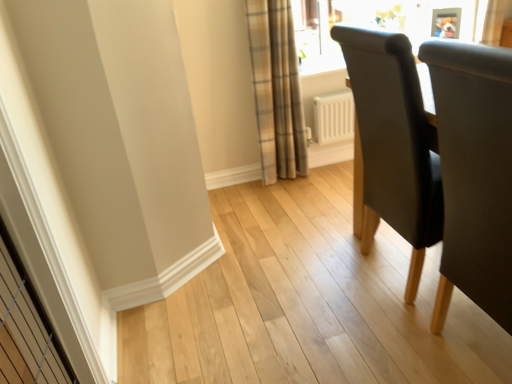
Question: Is black leather chair at right, placed as the 1th chair when sorted from front to back, closer to the viewer compared to plaid fabric curtain at upper center?

Choices:
 (A) yes
 (B) no

Answer: (A)

Question: From a real-world perspective, does black leather chair at right, positioned as the second chair in back-to-front order, stand above plaid fabric curtain at upper center?

Choices:
 (A) yes
 (B) no

Answer: (B)

Question: Are black leather chair at right, positioned as the second chair in back-to-front order, and plaid fabric curtain at upper center beside each other?

Choices:
 (A) no
 (B) yes

Answer: (A)

Question: Is black leather chair at right, placed as the 1th chair when sorted from front to back, thinner than plaid fabric curtain at upper center?

Choices:
 (A) no
 (B) yes

Answer: (A)

Question: Considering the relative positions of black leather chair at right, positioned as the second chair in back-to-front order, and plaid fabric curtain at upper center in the image provided, is black leather chair at right, positioned as the second chair in back-to-front order, to the right of plaid fabric curtain at upper center from the viewer's perspective?

Choices:
 (A) no
 (B) yes

Answer: (B)

Question: Considering their positions, is plaid fabric curtain at upper center located in front of or behind dark gray fabric chair at right, the 2th chair viewed from the front?

Choices:
 (A) front
 (B) behind

Answer: (B)

Question: From a real-world perspective, relative to dark gray fabric chair at right, which is the 1th chair from back to front, is plaid fabric curtain at upper center vertically above or below?

Choices:
 (A) below
 (B) above

Answer: (B)

Question: Does point (279, 89) appear closer or farther from the camera than point (362, 31)?

Choices:
 (A) closer
 (B) farther

Answer: (B)

Question: Considering the relative positions of plaid fabric curtain at upper center and dark gray fabric chair at right, the 2th chair viewed from the front, in the image provided, is plaid fabric curtain at upper center to the left or to the right of dark gray fabric chair at right, the 2th chair viewed from the front,?

Choices:
 (A) left
 (B) right

Answer: (A)

Question: Do you think dark gray fabric chair at right, the 2th chair viewed from the front, is within plaid fabric curtain at upper center, or outside of it?

Choices:
 (A) inside
 (B) outside

Answer: (B)

Question: Considering the positions of point (355, 216) and point (266, 180), is point (355, 216) closer or farther from the camera than point (266, 180)?

Choices:
 (A) farther
 (B) closer

Answer: (B)

Question: Is dark gray fabric chair at right, which is the 1th chair from back to front, in front of or behind plaid fabric curtain at upper center in the image?

Choices:
 (A) front
 (B) behind

Answer: (A)

Question: From a real-world perspective, is dark gray fabric chair at right, which is the 1th chair from back to front, positioned above or below plaid fabric curtain at upper center?

Choices:
 (A) below
 (B) above

Answer: (A)

Question: From a real-world perspective, is black leather chair at right, placed as the 1th chair when sorted from front to back, physically located above or below plaid fabric curtain at upper center?

Choices:
 (A) above
 (B) below

Answer: (B)

Question: Looking at their shapes, would you say black leather chair at right, positioned as the second chair in back-to-front order, is wider or thinner than plaid fabric curtain at upper center?

Choices:
 (A) wide
 (B) thin

Answer: (A)